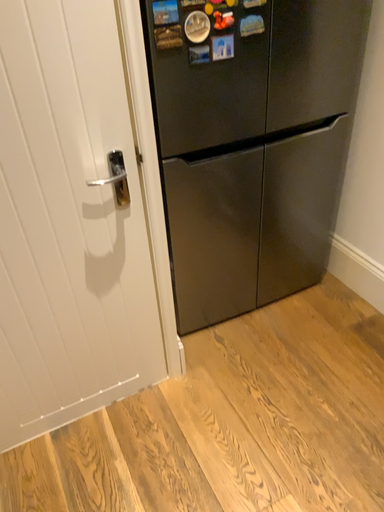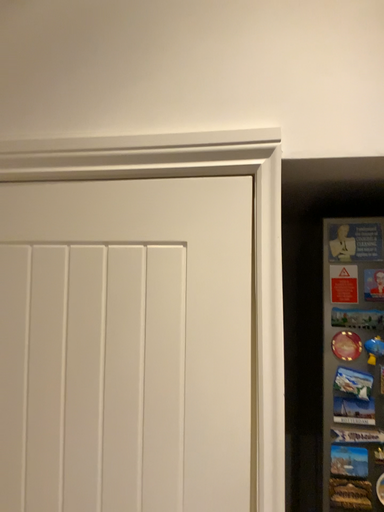
Question: Which way did the camera rotate in the video?

Choices:
 (A) rotated downward
 (B) rotated upward

Answer: (B)